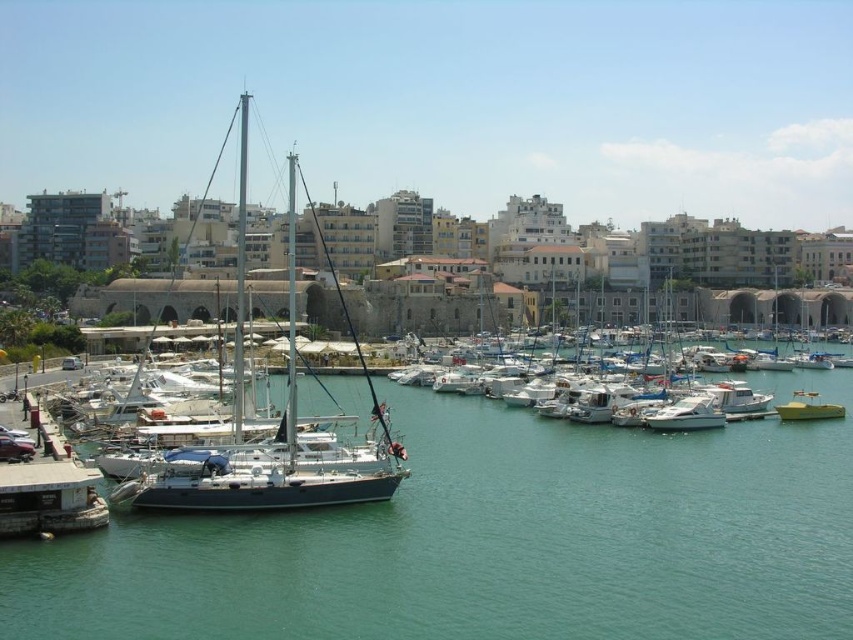
Question: Which point appears farthest from the camera in this image?

Choices:
 (A) (343, 474)
 (B) (474, 324)
 (C) (672, 420)
 (D) (561, 557)

Answer: (B)

Question: Among these points, which one is farthest from the camera?

Choices:
 (A) (456, 406)
 (B) (799, 392)

Answer: (A)

Question: Is white glossy sailboat at center smaller than green matte boat at center?

Choices:
 (A) yes
 (B) no

Answer: (B)

Question: Which is nearer to the white matte boat at center?

Choices:
 (A) teal water at center
 (B) green matte boat at center

Answer: (B)

Question: Considering the relative positions of white glossy sailboat at center and green matte boat at center in the image provided, where is white glossy sailboat at center located with respect to green matte boat at center?

Choices:
 (A) left
 (B) right

Answer: (A)

Question: Does teal water at center lie in front of green matte boat at center?

Choices:
 (A) yes
 (B) no

Answer: (A)